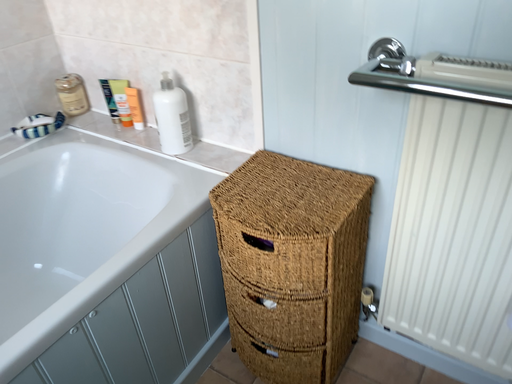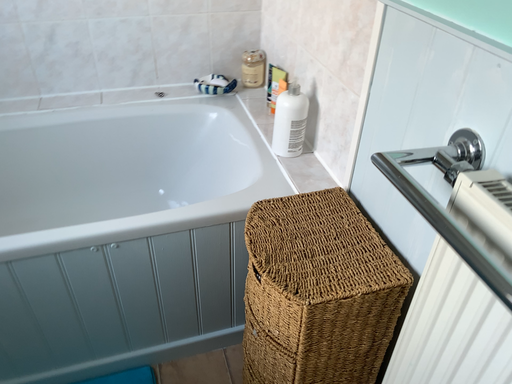
Question: Which way did the camera rotate in the video?

Choices:
 (A) rotated right
 (B) rotated left

Answer: (B)